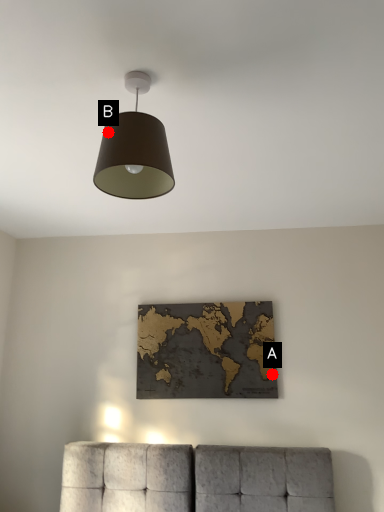
Question: Two points are circled on the image, labeled by A and B beside each circle. Among these points, which one is farthest from the camera?

Choices:
 (A) A is further
 (B) B is further

Answer: (A)